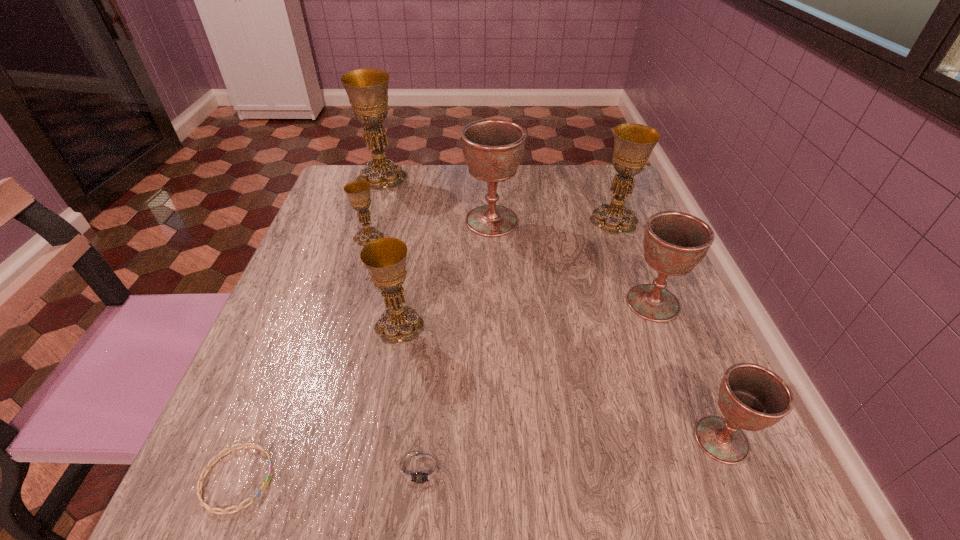
Image resolution: width=960 pixels, height=540 pixels. What are the coordinates of `empty space that is in between the rightmost gold chalice and the bracelet` in the screenshot? It's located at (425, 349).

Where is `free point between the third biggest gold chalice and the nearest brown chalice`? This screenshot has height=540, width=960. free point between the third biggest gold chalice and the nearest brown chalice is located at coordinates (561, 382).

At what (x,y) coordinates should I click in order to perform the action: click on empty space that is in between the second biggest brown chalice and the smallest brown chalice. Please return your answer as a coordinate pair (x, y). The image size is (960, 540). Looking at the image, I should click on (687, 372).

Locate an element on the screen. unoccupied position between the farthest object and the second nearest brown chalice is located at coordinates (517, 240).

Point out which object is positioned as the third nearest to the smallest gold chalice. Please provide its 2D coordinates. Your answer should be formatted as a tuple, i.e. [(x, y)], where the tuple contains the x and y coordinates of a point satisfying the conditions above.

[(385, 258)]

Locate an element on the screen. This screenshot has height=540, width=960. the second closest object to the smallest gold chalice is located at coordinates (493, 148).

Locate an element on the screen. Image resolution: width=960 pixels, height=540 pixels. the fifth closest chalice to the second farthest brown chalice is located at coordinates (358, 191).

The image size is (960, 540). In order to click on chalice that is the fifth closest one to the rightmost gold chalice in this screenshot , I will do `click(367, 89)`.

Where is `gold chalice that is the third nearest to the second biggest gold chalice`? gold chalice that is the third nearest to the second biggest gold chalice is located at coordinates (358, 191).

Image resolution: width=960 pixels, height=540 pixels. I want to click on gold chalice that is the third closest one to the third gold chalice from left to right, so click(633, 143).